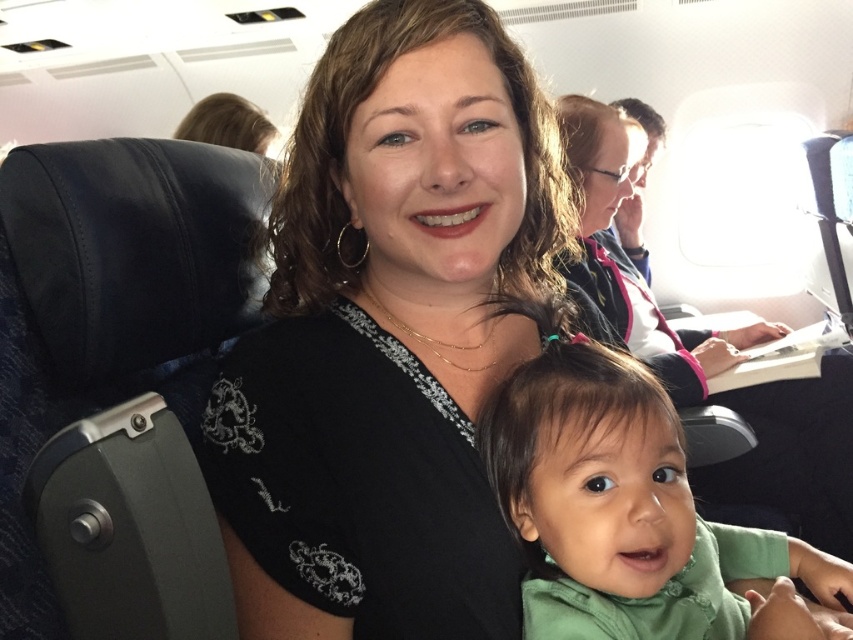
Question: Is black embroidered shirt at center further to camera compared to green soft fabric baby at center?

Choices:
 (A) yes
 (B) no

Answer: (B)

Question: Which point appears closest to the camera in this image?

Choices:
 (A) (651, 573)
 (B) (421, 477)

Answer: (A)

Question: Is black embroidered shirt at center to the right of green soft fabric baby at center from the viewer's perspective?

Choices:
 (A) no
 (B) yes

Answer: (A)

Question: Does black embroidered shirt at center have a lesser width compared to green soft fabric baby at center?

Choices:
 (A) no
 (B) yes

Answer: (B)